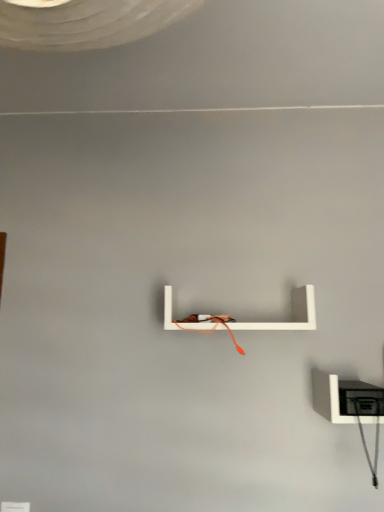
The image size is (384, 512). I want to click on white matte shelf at lower right, arranged as the 1th shelf when ordered from the bottom, so click(x=343, y=398).

What do you see at coordinates (343, 398) in the screenshot? The image size is (384, 512). I see `white matte shelf at lower right, which appears as the 2th shelf when viewed from the left` at bounding box center [343, 398].

How much space does white matte shelf at lower right, which appears as the 2th shelf when viewed from the left, occupy vertically?

The height of white matte shelf at lower right, which appears as the 2th shelf when viewed from the left, is 5.34 inches.

This screenshot has height=512, width=384. What do you see at coordinates (292, 314) in the screenshot? I see `white matte shelf at center, which appears as the second shelf when ordered from the bottom` at bounding box center [292, 314].

The height and width of the screenshot is (512, 384). I want to click on white matte shelf at center, which appears as the second shelf when ordered from the bottom, so click(x=292, y=314).

I want to click on white matte shelf at lower right, marked as the first shelf in a right-to-left arrangement, so tap(343, 398).

Considering the positions of objects white matte shelf at lower right, arranged as the 1th shelf when ordered from the bottom, and white matte shelf at center, the first shelf when ordered from top to bottom, in the image provided, who is more to the left, white matte shelf at lower right, arranged as the 1th shelf when ordered from the bottom, or white matte shelf at center, the first shelf when ordered from top to bottom,?

white matte shelf at center, the first shelf when ordered from top to bottom, is more to the left.

Considering their positions, is white matte shelf at lower right, marked as the first shelf in a right-to-left arrangement, located in front of or behind white matte shelf at center, which appears as the second shelf when ordered from the bottom?

Clearly, white matte shelf at lower right, marked as the first shelf in a right-to-left arrangement, is in front of white matte shelf at center, which appears as the second shelf when ordered from the bottom.

Is point (343, 409) in front of point (301, 318)?

Yes.

From the image's perspective, is white matte shelf at lower right, arranged as the 1th shelf when ordered from the bottom, on top of white matte shelf at center, the second shelf when ordered from right to left?

No, from the image's perspective, white matte shelf at lower right, arranged as the 1th shelf when ordered from the bottom, is not above white matte shelf at center, the second shelf when ordered from right to left.

From a real-world perspective, is white matte shelf at lower right, arranged as the 1th shelf when ordered from the bottom, positioned above or below white matte shelf at center, which appears as the second shelf when ordered from the bottom?

white matte shelf at lower right, arranged as the 1th shelf when ordered from the bottom, is situated lower than white matte shelf at center, which appears as the second shelf when ordered from the bottom, in the real world.

Based on the photo, between white matte shelf at lower right, which appears as the 2th shelf when viewed from the left, and white matte shelf at center, the first shelf in the left-to-right sequence, which one has larger width?

white matte shelf at lower right, which appears as the 2th shelf when viewed from the left, is wider.

Between white matte shelf at lower right, arranged as the 1th shelf when ordered from the bottom, and white matte shelf at center, the first shelf in the left-to-right sequence, which one has less height?

white matte shelf at lower right, arranged as the 1th shelf when ordered from the bottom, is shorter.

Which of these two, white matte shelf at lower right, marked as the first shelf in a right-to-left arrangement, or white matte shelf at center, which appears as the second shelf when ordered from the bottom, is bigger?

white matte shelf at center, which appears as the second shelf when ordered from the bottom.

Is white matte shelf at lower right, which appears as the 2th shelf when viewed from the left, located outside white matte shelf at center, the first shelf in the left-to-right sequence?

Indeed, white matte shelf at lower right, which appears as the 2th shelf when viewed from the left, is completely outside white matte shelf at center, the first shelf in the left-to-right sequence.

Is white matte shelf at lower right, which appears as the 2th shelf when viewed from the left, positioned far away from white matte shelf at center, the second shelf when ordered from right to left?

Actually, white matte shelf at lower right, which appears as the 2th shelf when viewed from the left, and white matte shelf at center, the second shelf when ordered from right to left, are a little close together.

Is white matte shelf at lower right, arranged as the 1th shelf when ordered from the bottom, facing towards white matte shelf at center, the first shelf when ordered from top to bottom?

No, white matte shelf at lower right, arranged as the 1th shelf when ordered from the bottom, is not turned towards white matte shelf at center, the first shelf when ordered from top to bottom.

How much distance is there between white matte shelf at lower right, which appears as the 2th shelf when viewed from the left, and white matte shelf at center, the first shelf when ordered from top to bottom?

The distance of white matte shelf at lower right, which appears as the 2th shelf when viewed from the left, from white matte shelf at center, the first shelf when ordered from top to bottom, is 9.25 inches.

You are a GUI agent. You are given a task and a screenshot of the screen. Output one action in this format:
    pyautogui.click(x=<x>, y=<y>)
    Task: Click on the shelf that is in front of the white matte shelf at center, the first shelf in the left-to-right sequence
    This screenshot has width=384, height=512.
    Given the screenshot: What is the action you would take?
    pyautogui.click(x=343, y=398)

Is white matte shelf at center, which appears as the second shelf when ordered from the bottom, to the left of white matte shelf at lower right, arranged as the 1th shelf when ordered from the bottom, from the viewer's perspective?

Yes, white matte shelf at center, which appears as the second shelf when ordered from the bottom, is to the left of white matte shelf at lower right, arranged as the 1th shelf when ordered from the bottom.

In the image, is white matte shelf at center, the first shelf when ordered from top to bottom, positioned in front of or behind white matte shelf at lower right, arranged as the 1th shelf when ordered from the bottom?

Clearly, white matte shelf at center, the first shelf when ordered from top to bottom, is behind white matte shelf at lower right, arranged as the 1th shelf when ordered from the bottom.

In the scene shown: Which is farther, [296,324] or [343,414]?

Positioned behind is point [296,324].

From the image's perspective, is white matte shelf at center, the first shelf when ordered from top to bottom, located above or below white matte shelf at lower right, arranged as the 1th shelf when ordered from the bottom?

white matte shelf at center, the first shelf when ordered from top to bottom, is above white matte shelf at lower right, arranged as the 1th shelf when ordered from the bottom.

From a real-world perspective, who is located higher, white matte shelf at center, which appears as the second shelf when ordered from the bottom, or white matte shelf at lower right, the 2th shelf from the top?

From a 3D spatial view, white matte shelf at center, which appears as the second shelf when ordered from the bottom, is above.

Which of these two, white matte shelf at center, the second shelf when ordered from right to left, or white matte shelf at lower right, marked as the first shelf in a right-to-left arrangement, is wider?

With larger width is white matte shelf at lower right, marked as the first shelf in a right-to-left arrangement.

From their relative heights in the image, would you say white matte shelf at center, the second shelf when ordered from right to left, is taller or shorter than white matte shelf at lower right, which appears as the 2th shelf when viewed from the left?

Considering their sizes, white matte shelf at center, the second shelf when ordered from right to left, has more height than white matte shelf at lower right, which appears as the 2th shelf when viewed from the left.

Considering the sizes of white matte shelf at center, the second shelf when ordered from right to left, and white matte shelf at lower right, which appears as the 2th shelf when viewed from the left, in the image, is white matte shelf at center, the second shelf when ordered from right to left, bigger or smaller than white matte shelf at lower right, which appears as the 2th shelf when viewed from the left,?

In the image, white matte shelf at center, the second shelf when ordered from right to left, appears to be larger than white matte shelf at lower right, which appears as the 2th shelf when viewed from the left.

Does white matte shelf at center, the second shelf when ordered from right to left, contain white matte shelf at lower right, marked as the first shelf in a right-to-left arrangement?

That's incorrect, white matte shelf at lower right, marked as the first shelf in a right-to-left arrangement, is not inside white matte shelf at center, the second shelf when ordered from right to left.

Would you consider white matte shelf at center, the second shelf when ordered from right to left, to be distant from white matte shelf at lower right, the 2th shelf from the top?

No.

Is white matte shelf at center, the second shelf when ordered from right to left, facing away from white matte shelf at lower right, arranged as the 1th shelf when ordered from the bottom?

No, white matte shelf at lower right, arranged as the 1th shelf when ordered from the bottom, is not at the back of white matte shelf at center, the second shelf when ordered from right to left.

The image size is (384, 512). In order to click on shelf on the right of white matte shelf at center, the second shelf when ordered from right to left in this screenshot , I will do `click(343, 398)`.

At what (x,y) coordinates should I click in order to perform the action: click on shelf behind the white matte shelf at lower right, the 2th shelf from the top. Please return your answer as a coordinate pair (x, y). Looking at the image, I should click on (292, 314).

You are a GUI agent. You are given a task and a screenshot of the screen. Output one action in this format:
    pyautogui.click(x=<x>, y=<y>)
    Task: Click on the shelf below the white matte shelf at center, which appears as the second shelf when ordered from the bottom (from the image's perspective)
    The width and height of the screenshot is (384, 512).
    Given the screenshot: What is the action you would take?
    pyautogui.click(x=343, y=398)